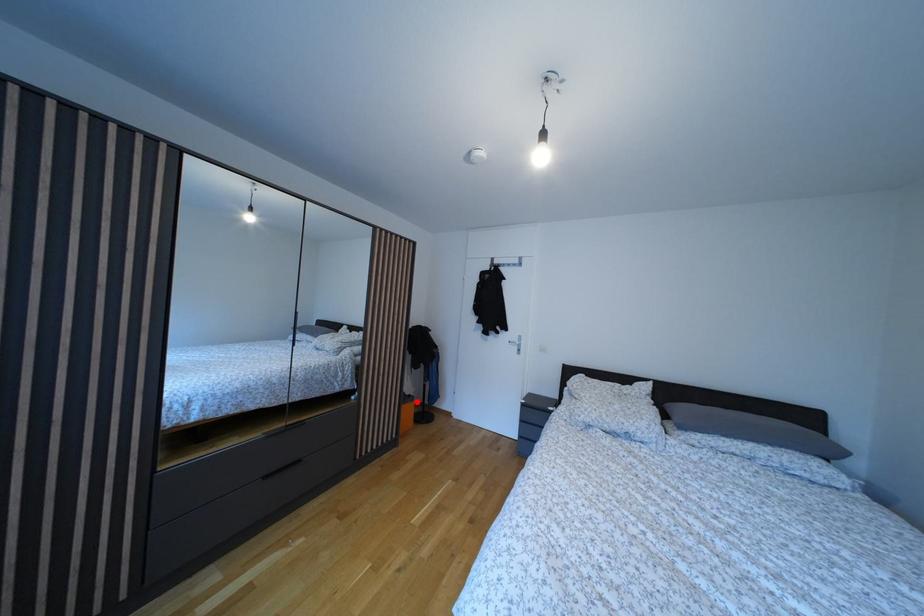
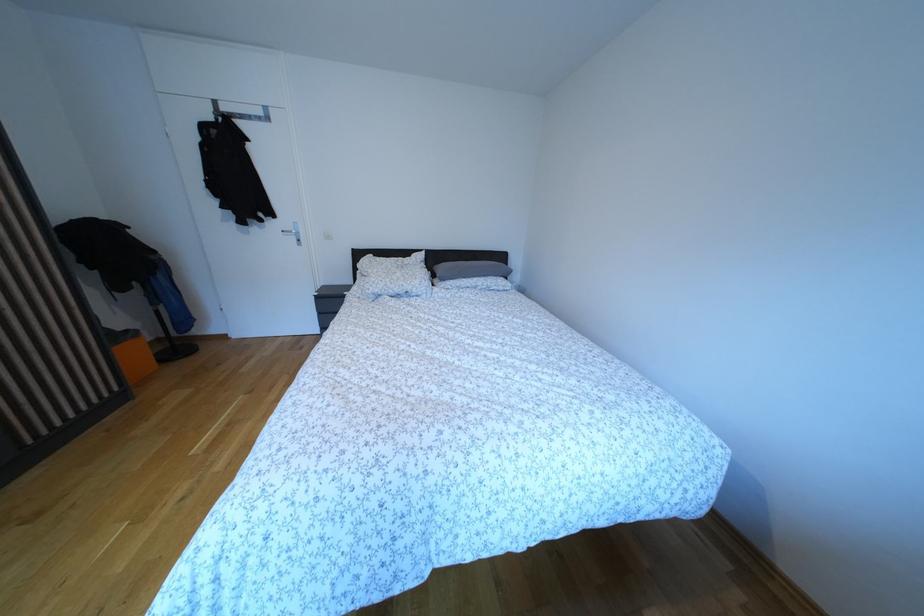
Locate, in the second image, the point that corresponds to the highlighted location in the first image.

(134, 338)